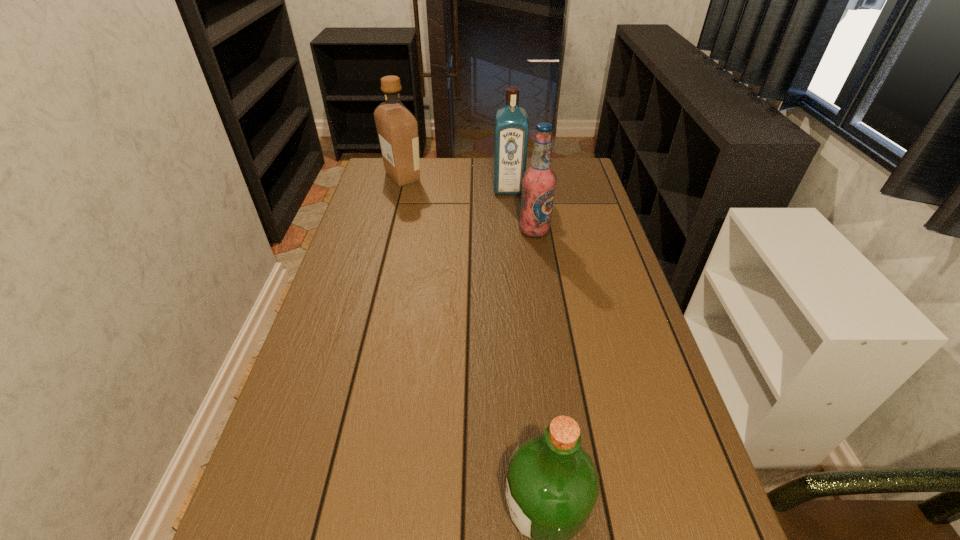
You are a GUI agent. You are given a task and a screenshot of the screen. Output one action in this format:
    pyautogui.click(x=<x>, y=<y>)
    Task: Click on the free space at the far right corner of the desktop
    This screenshot has height=540, width=960.
    Given the screenshot: What is the action you would take?
    pyautogui.click(x=588, y=185)

The width and height of the screenshot is (960, 540). Find the location of `free space between the alcohol and the leftmost object`. free space between the alcohol and the leftmost object is located at coordinates click(x=468, y=204).

Select which object is the third closest to the leftmost object. Please provide its 2D coordinates. Your answer should be formatted as a tuple, i.e. [(x, y)], where the tuple contains the x and y coordinates of a point satisfying the conditions above.

[(552, 485)]

You are a GUI agent. You are given a task and a screenshot of the screen. Output one action in this format:
    pyautogui.click(x=<x>, y=<y>)
    Task: Click on the second closest object to the third farthest object
    The image size is (960, 540).
    Given the screenshot: What is the action you would take?
    pyautogui.click(x=397, y=128)

At what (x,y) coordinates should I click in order to perform the action: click on liquor that is the closest to the shortest liquor. Please return your answer as a coordinate pair (x, y). The image size is (960, 540). Looking at the image, I should click on (511, 125).

Where is `liquor identified as the closest to the shortest liquor`? The height and width of the screenshot is (540, 960). liquor identified as the closest to the shortest liquor is located at coordinates (511, 125).

You are a GUI agent. You are given a task and a screenshot of the screen. Output one action in this format:
    pyautogui.click(x=<x>, y=<y>)
    Task: Click on the free space that satisfies the following two spatial constraints: 1. on the back side of the alcohol; 2. on the front-facing side of the leftmost liquor
    
    Given the screenshot: What is the action you would take?
    pyautogui.click(x=526, y=177)